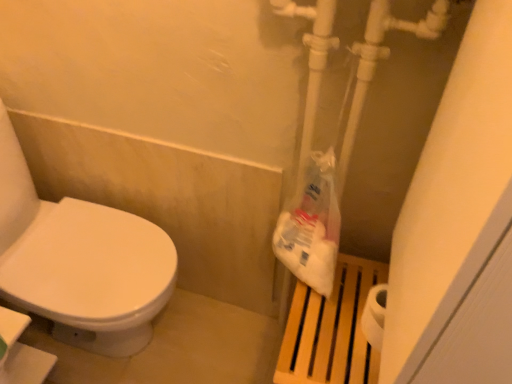
Locate an element on the screen. The height and width of the screenshot is (384, 512). white plastic bag at right is located at coordinates (312, 227).

The height and width of the screenshot is (384, 512). Describe the element at coordinates (312, 227) in the screenshot. I see `white plastic bag at right` at that location.

Measure the distance between point (343, 299) and camera.

The depth of point (343, 299) is 1.04 meters.

What do you see at coordinates (331, 329) in the screenshot?
I see `wooden slats at right` at bounding box center [331, 329].

The image size is (512, 384). In order to click on wooden slats at right in this screenshot , I will do `click(331, 329)`.

The height and width of the screenshot is (384, 512). In order to click on white plastic bag at right in this screenshot , I will do `click(312, 227)`.

Considering the positions of objects white plastic bag at right and wooden slats at right in the image provided, who is more to the right, white plastic bag at right or wooden slats at right?

wooden slats at right.

Which object is closer to the camera, white plastic bag at right or wooden slats at right?

white plastic bag at right is more forward.

Is point (316, 239) behind point (337, 282)?

No, (316, 239) is in front of (337, 282).

From the image's perspective, is white plastic bag at right located beneath wooden slats at right?

Incorrect, from the image's perspective, white plastic bag at right is higher than wooden slats at right.

From a real-world perspective, is white plastic bag at right physically located above or below wooden slats at right?

From a real-world perspective, white plastic bag at right is physically above wooden slats at right.

Consider the image. Considering the relative sizes of white plastic bag at right and wooden slats at right in the image provided, is white plastic bag at right wider than wooden slats at right?

In fact, white plastic bag at right might be narrower than wooden slats at right.

Considering the sizes of white plastic bag at right and wooden slats at right in the image, is white plastic bag at right taller or shorter than wooden slats at right?

In the image, white plastic bag at right appears to be shorter than wooden slats at right.

Consider the image. Considering the relative sizes of white plastic bag at right and wooden slats at right in the image provided, is white plastic bag at right smaller than wooden slats at right?

Correct, white plastic bag at right occupies less space than wooden slats at right.

Would you say white plastic bag at right contains wooden slats at right?

No, wooden slats at right is not surrounded by white plastic bag at right.

Is white plastic bag at right in contact with wooden slats at right?

No, white plastic bag at right is not touching wooden slats at right.

Does white plastic bag at right turn towards wooden slats at right?

No, white plastic bag at right does not turn towards wooden slats at right.

What's the angular difference between white plastic bag at right and wooden slats at right's facing directions?

They differ by 0.000484 degrees in their facing directions.

Locate an element on the screen. The width and height of the screenshot is (512, 384). step stool below the white plastic bag at right (from the image's perspective) is located at coordinates (331, 329).

Between wooden slats at right and white plastic bag at right, which one appears on the left side from the viewer's perspective?

white plastic bag at right.

Relative to white plastic bag at right, is wooden slats at right in front or behind?

Clearly, wooden slats at right is behind white plastic bag at right.

Which point is more forward, (361, 352) or (294, 215)?

The point (361, 352) is more forward.

From the image's perspective, relative to white plastic bag at right, is wooden slats at right above or below?

wooden slats at right is situated lower than white plastic bag at right in the image.

From a real-world perspective, relative to white plastic bag at right, is wooden slats at right vertically above or below?

From a real-world perspective, wooden slats at right is physically below white plastic bag at right.

Between wooden slats at right and white plastic bag at right, which one has smaller width?

white plastic bag at right is thinner.

Can you confirm if wooden slats at right is shorter than white plastic bag at right?

Incorrect, the height of wooden slats at right does not fall short of that of white plastic bag at right.

Between wooden slats at right and white plastic bag at right, which one has larger size?

wooden slats at right.

Is wooden slats at right not inside white plastic bag at right?

Yes, wooden slats at right is outside of white plastic bag at right.

Are wooden slats at right and white plastic bag at right far apart?

That's not correct — wooden slats at right is a little close to white plastic bag at right.

Could you tell me if wooden slats at right is turned towards white plastic bag at right?

No, wooden slats at right is not aimed at white plastic bag at right.

What's the angular difference between wooden slats at right and white plastic bag at right's facing directions?

The angular difference between wooden slats at right and white plastic bag at right is 0.000484 degrees.

Measure the distance from wooden slats at right to white plastic bag at right.

wooden slats at right is 12.24 centimeters away from white plastic bag at right.

Locate an element on the screen. The height and width of the screenshot is (384, 512). paper bag that appears above the wooden slats at right (from the image's perspective) is located at coordinates (312, 227).

This screenshot has width=512, height=384. I want to click on step stool lying behind the white plastic bag at right, so click(x=331, y=329).

I want to click on step stool below the white plastic bag at right (from a real-world perspective), so click(331, 329).